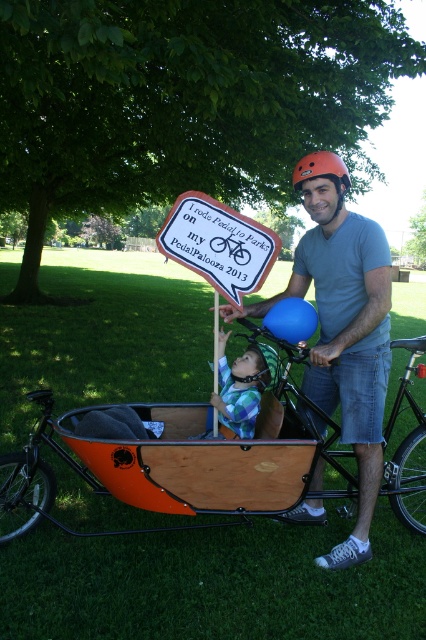
You are a photographer standing at the edge of the park. You want to take a photo of the matte gray helmet at upper center while keeping the camera in your hands. Can you hold the camera close enough to the helmet to capture it clearly without moving either the helmet or the camera?

The matte gray helmet at upper center and the camera are 2.96 meters apart from each other. Since the photographer cannot move either, the distance is too far to capture the helmet clearly while holding the camera in their hands.

You are a photographer trying to capture a closeup of the matte gray helmet at upper center and the checkered fabric baby at center. If your camera can only focus on objects within 50 centimeters of each other, will you be able to get a clear shot of both subjects?

The matte gray helmet at upper center is 49.02 centimeters from the checkered fabric baby at center, so yes, the camera can focus on both subjects since they are within the 50 centimeter range.

Consider the image. You are a photographer trying to capture the matte gray helmet at upper center in your shot. Based on the scene, where should you position your camera to ensure it is centered in the frame?

The matte gray helmet at upper center is located at point (342, 326), so position your camera to center the frame at those coordinates to capture it.